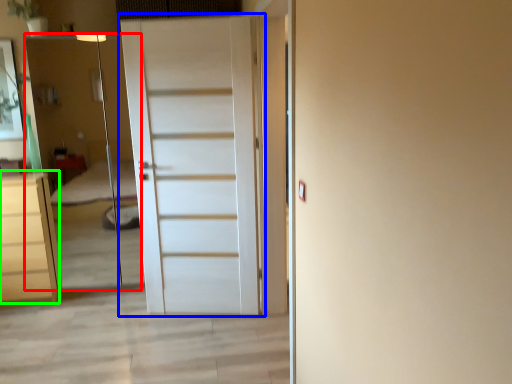
Question: Based on their relative distances, which object is nearer to elevator (highlighted by a red box)? Choose from door (highlighted by a blue box) and chest of drawers (highlighted by a green box).

Choices:
 (A) door
 (B) chest of drawers

Answer: (B)